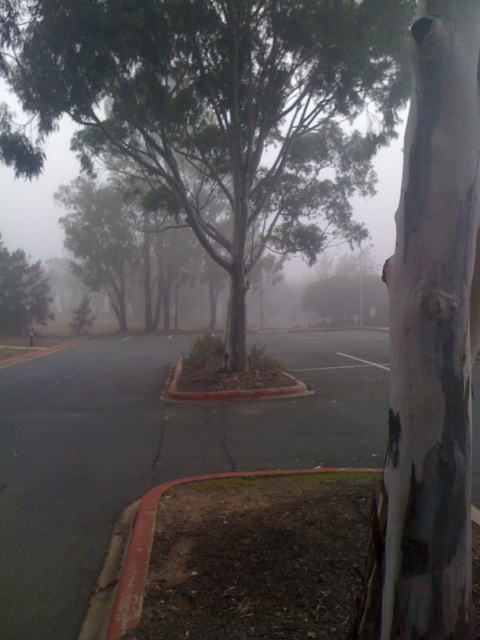
Question: Which point is farther from the camera taking this photo?

Choices:
 (A) click(23, 250)
 (B) click(420, 228)

Answer: (A)

Question: Which object is the farthest from the white/scaly tree trunk at center-right?

Choices:
 (A) green matte tree at center
 (B) green rough bark tree at center

Answer: (A)

Question: Which of the following is the closest to the observer?

Choices:
 (A) green matte tree at center
 (B) white/scaly tree trunk at center-right
 (C) green rough bark tree at center

Answer: (B)

Question: Can you confirm if green rough bark tree at center is positioned above white/scaly tree trunk at center-right?

Choices:
 (A) no
 (B) yes

Answer: (B)

Question: Is green rough bark tree at center to the right of white/scaly tree trunk at center-right from the viewer's perspective?

Choices:
 (A) no
 (B) yes

Answer: (A)

Question: Does white/scaly tree trunk at center-right have a greater width compared to green matte tree at center?

Choices:
 (A) no
 (B) yes

Answer: (A)